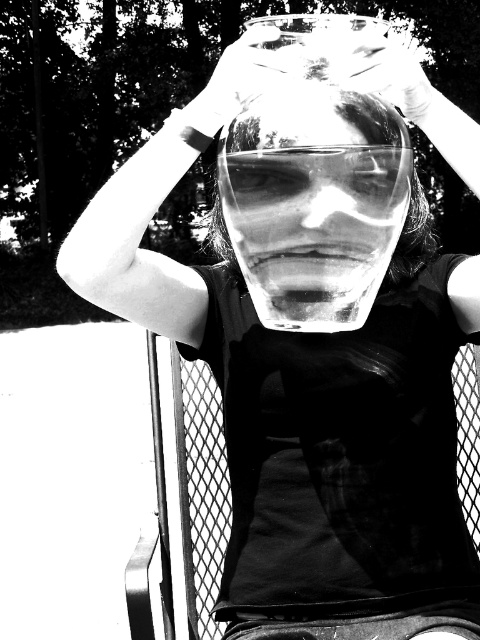
Question: Which of the following is the closest to the observer?

Choices:
 (A) transparent glass at center
 (B) transparent plastic hand at upper center
 (C) translucent plastic hand at upper center

Answer: (A)

Question: Can you confirm if transparent glass at center is thinner than translucent plastic hand at upper center?

Choices:
 (A) no
 (B) yes

Answer: (A)

Question: Does transparent glass at center appear over translucent plastic hand at upper center?

Choices:
 (A) no
 (B) yes

Answer: (A)

Question: Considering the relative positions of transparent glass at center and translucent plastic hand at upper center in the image provided, where is transparent glass at center located with respect to translucent plastic hand at upper center?

Choices:
 (A) right
 (B) left

Answer: (B)

Question: Based on their relative distances, which object is farther from the translucent plastic hand at upper center?

Choices:
 (A) transparent plastic hand at upper center
 (B) transparent glass at center

Answer: (A)

Question: Which of the following is the farthest from the observer?

Choices:
 (A) coord(222,118)
 (B) coord(327,81)
 (C) coord(395,81)

Answer: (A)